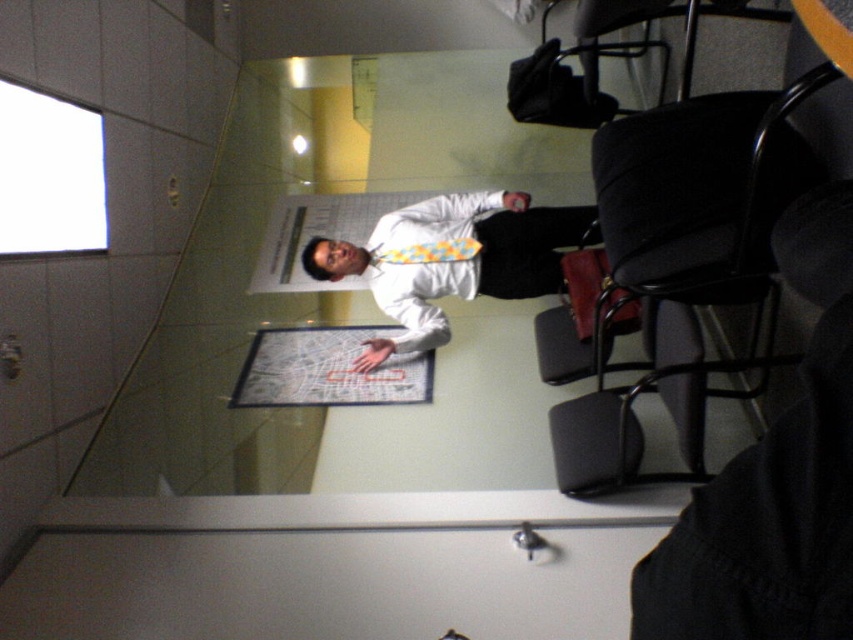
Which of these two, white paper clipboard at center or yellow tie at center, stands taller?

yellow tie at center is taller.

Who is more forward, (393, 355) or (363, 220)?

Point (393, 355) is in front.

Which is behind, point (376, 378) or point (354, 237)?

Positioned behind is point (354, 237).

You are a GUI agent. You are given a task and a screenshot of the screen. Output one action in this format:
    pyautogui.click(x=<x>, y=<y>)
    Task: Click on the white paper clipboard at center
    This screenshot has width=853, height=640.
    Given the screenshot: What is the action you would take?
    pyautogui.click(x=328, y=369)

Is white glossy shirt at center taller than yellow tie at center?

Indeed, white glossy shirt at center has a greater height compared to yellow tie at center.

Is white glossy shirt at center closer to the viewer compared to yellow tie at center?

Yes, it is.

Between point (547, 224) and point (350, 204), which one is positioned in front?

Point (547, 224)

Where is `white glossy shirt at center`? The image size is (853, 640). white glossy shirt at center is located at coordinates (451, 259).

Is white glossy shirt at center bigger than black plastic chair at upper right?

No, white glossy shirt at center is not bigger than black plastic chair at upper right.

Is point (425, 323) farther from camera compared to point (595, 83)?

Yes, it is.

Find the location of a particular element. The height and width of the screenshot is (640, 853). white glossy shirt at center is located at coordinates (451, 259).